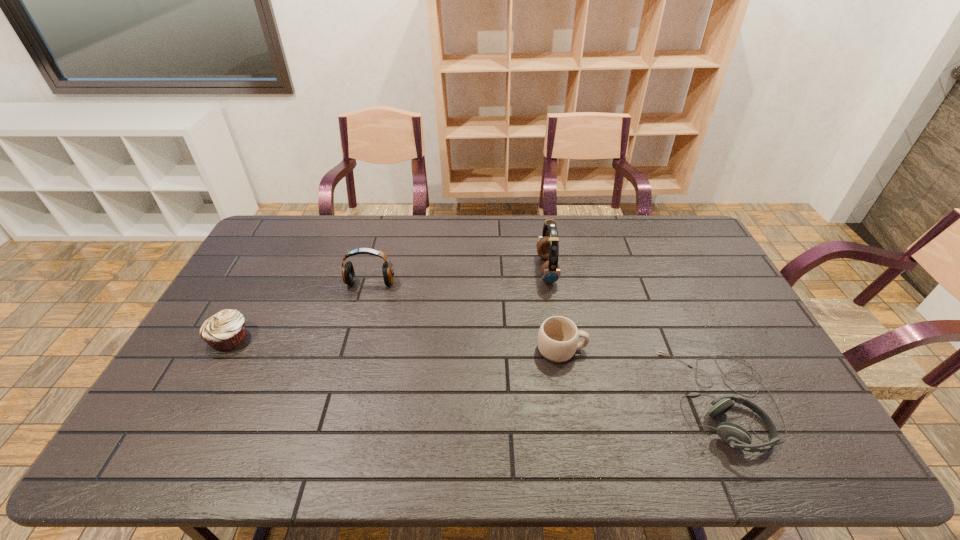
You are a GUI agent. You are given a task and a screenshot of the screen. Output one action in this format:
    pyautogui.click(x=<x>, y=<y>)
    Task: Click on the empty location between the leftmost headset and the muffin
    The height and width of the screenshot is (540, 960).
    Given the screenshot: What is the action you would take?
    pyautogui.click(x=300, y=310)

Where is `vacant area that lies between the leftmost object and the fourth shortest object`? vacant area that lies between the leftmost object and the fourth shortest object is located at coordinates (300, 310).

Where is `free spot between the nearest headset and the tallest headset`? The width and height of the screenshot is (960, 540). free spot between the nearest headset and the tallest headset is located at coordinates (636, 335).

Image resolution: width=960 pixels, height=540 pixels. What are the coordinates of `free space between the tallest headset and the leftmost object` in the screenshot? It's located at (388, 305).

This screenshot has width=960, height=540. Find the location of `free space that is in between the mug and the rightmost headset`. free space that is in between the mug and the rightmost headset is located at coordinates (642, 375).

This screenshot has height=540, width=960. Identify the location of unoccupied position between the rightmost headset and the mug. (642, 375).

The height and width of the screenshot is (540, 960). What are the coordinates of `free space between the mug and the tallest object` in the screenshot? It's located at (554, 309).

This screenshot has height=540, width=960. What are the coordinates of `free area in between the tallest headset and the second tallest headset` in the screenshot? It's located at (459, 276).

Locate an element on the screen. The height and width of the screenshot is (540, 960). object that is the second closest to the tallest headset is located at coordinates (737, 437).

Choose which object is the third nearest neighbor to the tallest object. Please provide its 2D coordinates. Your answer should be formatted as a tuple, i.e. [(x, y)], where the tuple contains the x and y coordinates of a point satisfying the conditions above.

[(348, 274)]